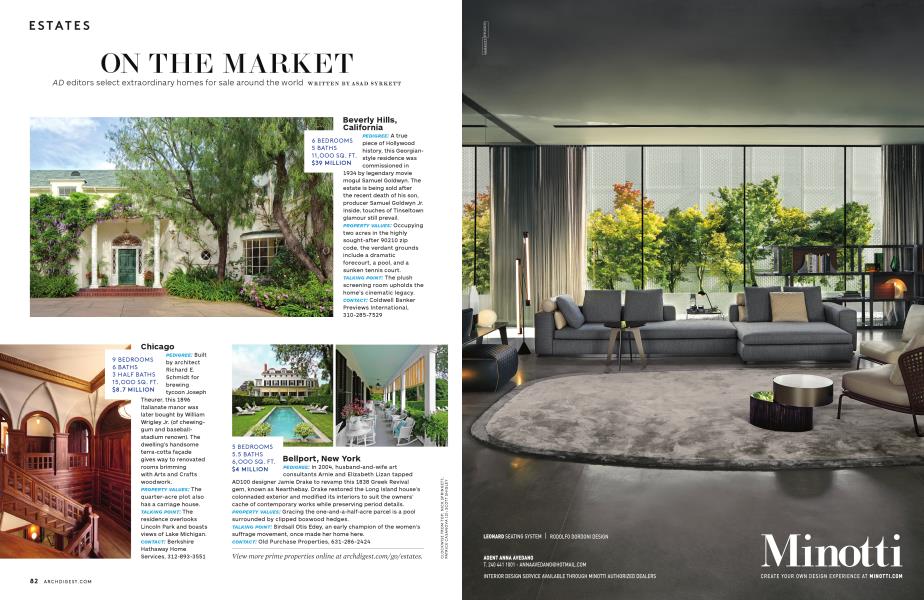
What are the coordinates of `oval rug` in the screenshot? It's located at (700, 425).